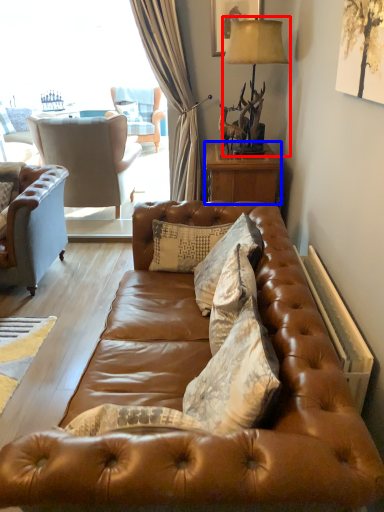
Question: Which point is further to the camera, table lamp (highlighted by a red box) or nightstand (highlighted by a blue box)?

Choices:
 (A) table lamp
 (B) nightstand

Answer: (B)